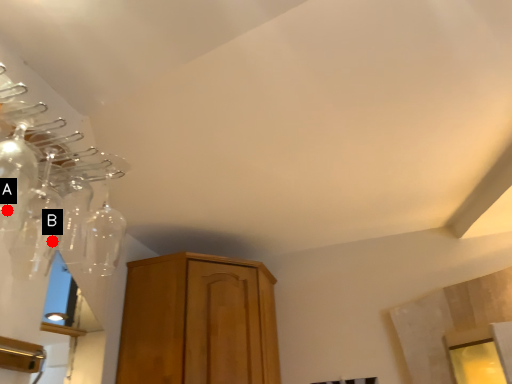
Question: Two points are circled on the image, labeled by A and B beside each circle. Which point is closer to the camera taking this photo?

Choices:
 (A) A is closer
 (B) B is closer

Answer: (A)